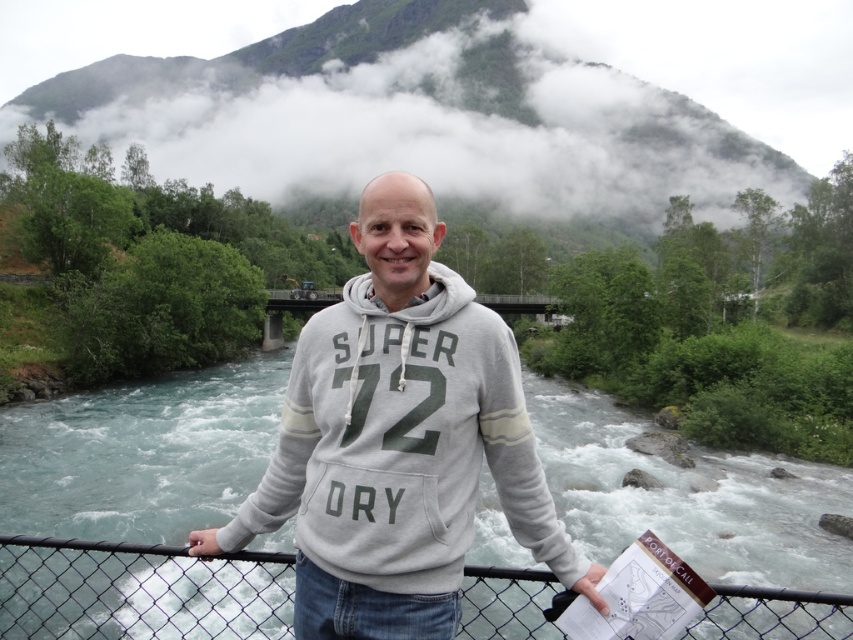
Who is more distant from viewer, (189, 536) or (311, 305)?

The point (311, 305) is behind.

Does gray cotton hoodie at center appear on the left side of concrete bridge at center?

Indeed, gray cotton hoodie at center is positioned on the left side of concrete bridge at center.

Between point (384, 282) and point (299, 304), which one is positioned behind?

The point (299, 304) is behind.

Image resolution: width=853 pixels, height=640 pixels. Find the location of `gray cotton hoodie at center`. gray cotton hoodie at center is located at coordinates (399, 440).

Which is in front, point (378, 525) or point (757, 627)?

Positioned in front is point (378, 525).

Does gray cotton hoodie at center lie in front of wire mesh fence at center?

A: Yes, it is in front of wire mesh fence at center.

You are a GUI agent. You are given a task and a screenshot of the screen. Output one action in this format:
    pyautogui.click(x=<x>, y=<y>)
    Task: Click on the gray cotton hoodie at center
    
    Given the screenshot: What is the action you would take?
    pyautogui.click(x=399, y=440)

Which is in front, point (416, 72) or point (241, 602)?

Point (241, 602) is more forward.

Is point (561, 180) farther from viewer compared to point (165, 588)?

That is True.

Locate an element on the screen. white fluffy cloud at upper center is located at coordinates (424, 125).